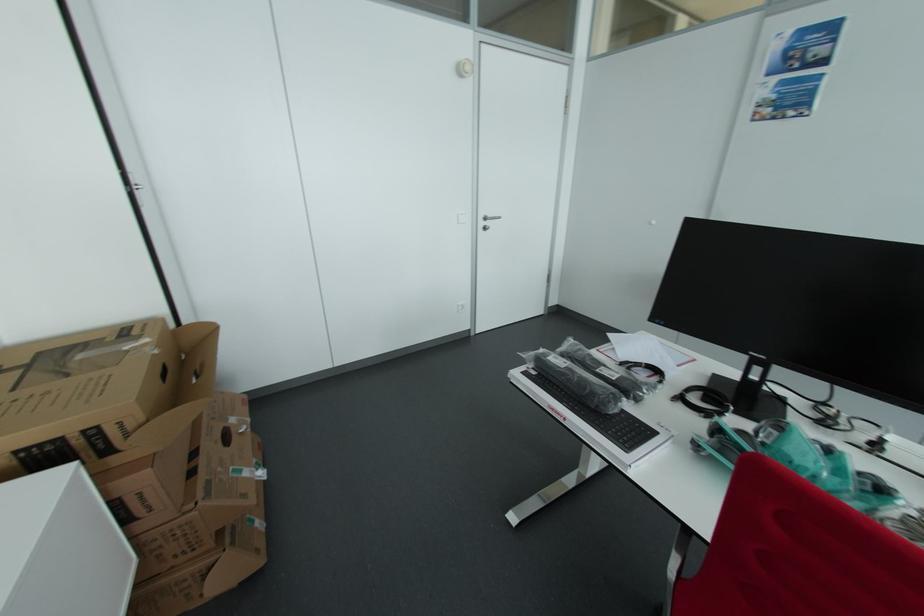
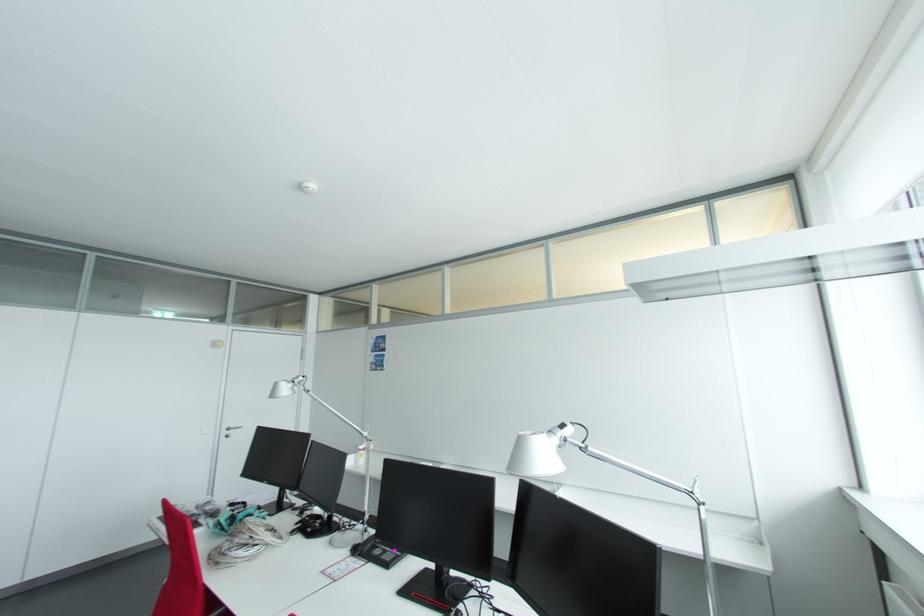
Locate, in the second image, the point that corresponds to the point at 490,219 in the first image.

(232, 430)